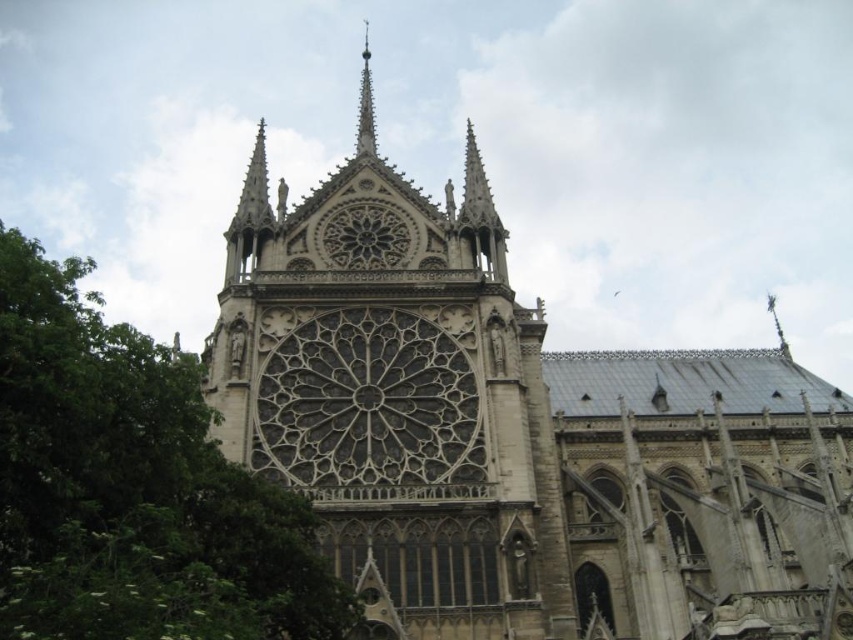
Is the position of green leafy tree at left less distant than that of polished silver spire at upper center?

That is True.

Which is above, green leafy tree at left or polished silver spire at upper center?

polished silver spire at upper center

The image size is (853, 640). Identify the location of green leafy tree at left. (132, 486).

The height and width of the screenshot is (640, 853). What are the coordinates of `green leafy tree at left` in the screenshot? It's located at (x=132, y=486).